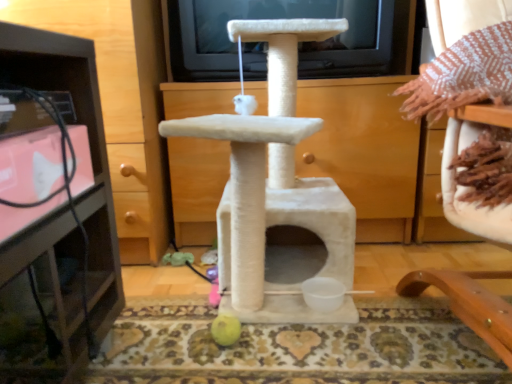
Question: Does beige fabric chair at upper right, the 1th furniture in the right-to-left sequence, appear on the right side of brushed metal tv stand at left, the second furniture when ordered from right to left?

Choices:
 (A) yes
 (B) no

Answer: (A)

Question: From a real-world perspective, is beige fabric chair at upper right, which appears as the 1th furniture when viewed from the front, located beneath brushed metal tv stand at left, which is the second furniture from front to back?

Choices:
 (A) no
 (B) yes

Answer: (B)

Question: Does beige fabric chair at upper right, the second furniture in the left-to-right sequence, have a lesser width compared to brushed metal tv stand at left, the 1th furniture positioned from the left?

Choices:
 (A) yes
 (B) no

Answer: (B)

Question: Considering the relative positions of beige fabric chair at upper right, the second furniture in the left-to-right sequence, and brushed metal tv stand at left, which ranks as the 1th furniture in back-to-front order, in the image provided, is beige fabric chair at upper right, the second furniture in the left-to-right sequence, in front of brushed metal tv stand at left, which ranks as the 1th furniture in back-to-front order,?

Choices:
 (A) no
 (B) yes

Answer: (B)

Question: From the image's perspective, is beige fabric chair at upper right, the second furniture in the left-to-right sequence, on top of brushed metal tv stand at left, which is the second furniture from front to back?

Choices:
 (A) no
 (B) yes

Answer: (A)

Question: Can you confirm if beige fabric chair at upper right, the 1th furniture in the right-to-left sequence, is wider than brushed metal tv stand at left, which is the second furniture from front to back?

Choices:
 (A) yes
 (B) no

Answer: (A)

Question: Is brushed metal tv stand at left, the second furniture when ordered from right to left, to the right of beige fabric chair at upper right, which is the second furniture from back to front, from the viewer's perspective?

Choices:
 (A) no
 (B) yes

Answer: (A)

Question: Does brushed metal tv stand at left, which ranks as the 1th furniture in back-to-front order, contain beige fabric chair at upper right, the second furniture in the left-to-right sequence?

Choices:
 (A) yes
 (B) no

Answer: (B)

Question: Can you confirm if brushed metal tv stand at left, the 1th furniture positioned from the left, is smaller than beige fabric chair at upper right, the second furniture in the left-to-right sequence?

Choices:
 (A) yes
 (B) no

Answer: (B)

Question: Can we say brushed metal tv stand at left, the 1th furniture positioned from the left, lies outside beige fabric chair at upper right, the 1th furniture in the right-to-left sequence?

Choices:
 (A) no
 (B) yes

Answer: (B)

Question: Are brushed metal tv stand at left, which ranks as the 1th furniture in back-to-front order, and beige fabric chair at upper right, which is the second furniture from back to front, beside each other?

Choices:
 (A) yes
 (B) no

Answer: (B)

Question: Is brushed metal tv stand at left, the 1th furniture positioned from the left, not near beige fabric chair at upper right, the 1th furniture in the right-to-left sequence?

Choices:
 (A) yes
 (B) no

Answer: (B)

Question: From the image's perspective, is brushed metal tv stand at left, the 1th furniture positioned from the left, located above or below beige fabric chair at upper right, the 1th furniture in the right-to-left sequence?

Choices:
 (A) below
 (B) above

Answer: (B)